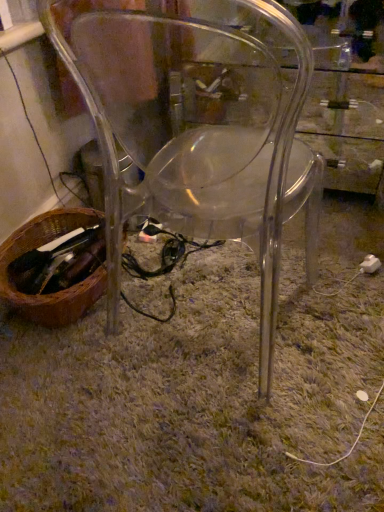
Measure the distance between green shaggy carpet at center and camera.

green shaggy carpet at center is 31.83 inches away from camera.

The image size is (384, 512). Find the location of `green shaggy carpet at center`. green shaggy carpet at center is located at coordinates (198, 401).

Does point (93, 288) come behind point (31, 468)?

Yes, it is.

From a real-world perspective, is brown woven basket at lower left above or below green shaggy carpet at center?

brown woven basket at lower left is situated higher than green shaggy carpet at center in the real world.

From the image's perspective, relative to green shaggy carpet at center, is brown woven basket at lower left above or below?

Based on their image positions, brown woven basket at lower left is located beneath green shaggy carpet at center.

Would you say brown woven basket at lower left is inside or outside green shaggy carpet at center?

brown woven basket at lower left is located beyond the bounds of green shaggy carpet at center.

Does white plastic plug at lower right have a lesser width compared to transparent plastic chair at center?

Yes.

Is white plastic plug at lower right spatially inside transparent plastic chair at center, or outside of it?

white plastic plug at lower right exists outside the volume of transparent plastic chair at center.

From a real-world perspective, is white plastic plug at lower right positioned under transparent plastic chair at center based on gravity?

Yes, from a real-world perspective, white plastic plug at lower right is below transparent plastic chair at center.

In the scene shown: Looking at the image, does white plastic plug at lower right seem bigger or smaller compared to transparent plastic chair at center?

Considering their sizes, white plastic plug at lower right takes up less space than transparent plastic chair at center.

Considering the sizes of objects transparent plastic chair at center and white plastic plug at lower right in the image provided, who is wider, transparent plastic chair at center or white plastic plug at lower right?

With larger width is transparent plastic chair at center.

Is point (201, 150) closer or farther from the camera than point (378, 265)?

Clearly, point (201, 150) is closer to the camera than point (378, 265).

Would you say transparent plastic chair at center is inside or outside white plastic plug at lower right?

transparent plastic chair at center lies outside white plastic plug at lower right.

Based on the photo, considering the relative positions of transparent plastic chair at center and white plastic plug at lower right in the image provided, is transparent plastic chair at center in front of white plastic plug at lower right?

Yes, it is in front of white plastic plug at lower right.

Is green shaggy carpet at center not within transparent plastic chair at center?

Indeed, green shaggy carpet at center is completely outside transparent plastic chair at center.

Is point (90, 494) behind point (247, 210)?

No, it is not.

In the image, is green shaggy carpet at center on the left side or the right side of transparent plastic chair at center?

green shaggy carpet at center is to the right of transparent plastic chair at center.

Does white plastic plug at lower right have a lesser width compared to brown woven basket at lower left?

Yes, white plastic plug at lower right is thinner than brown woven basket at lower left.

Is white plastic plug at lower right at the left side of brown woven basket at lower left?

In fact, white plastic plug at lower right is to the right of brown woven basket at lower left.

Could you tell me if white plastic plug at lower right is turned towards brown woven basket at lower left?

No, white plastic plug at lower right does not turn towards brown woven basket at lower left.

How much distance is there between white plastic plug at lower right and brown woven basket at lower left?

white plastic plug at lower right is 35.45 inches from brown woven basket at lower left.

Between green shaggy carpet at center and brown woven basket at lower left, which one has less height?

green shaggy carpet at center.

From a real-world perspective, is green shaggy carpet at center beneath brown woven basket at lower left?

Yes, from a real-world perspective, green shaggy carpet at center is under brown woven basket at lower left.

From the picture: Which object is wider, green shaggy carpet at center or brown woven basket at lower left?

green shaggy carpet at center.

Consider the image. Does green shaggy carpet at center have a larger size compared to brown woven basket at lower left?

Yes.

Based on the photo, what's the angular difference between white plastic plug at lower right and green shaggy carpet at center's facing directions?

58.4 degrees.

Locate an element on the screen. Image resolution: width=384 pixels, height=512 pixels. grass that is above the white plastic plug at lower right (from the image's perspective) is located at coordinates (198, 401).

Is white plastic plug at lower right inside the boundaries of green shaggy carpet at center, or outside?

white plastic plug at lower right is enclosed within green shaggy carpet at center.

Considering the positions of objects white plastic plug at lower right and green shaggy carpet at center in the image provided, who is more to the right, white plastic plug at lower right or green shaggy carpet at center?

white plastic plug at lower right is more to the right.

This screenshot has height=512, width=384. Identify the location of grass on the right side of brown woven basket at lower left. (198, 401).

Find the location of a particular element. chair that is above the white plastic plug at lower right (from a real-world perspective) is located at coordinates (200, 130).

Based on the photo, looking at the image, which one is located further to transparent plastic chair at center, brown woven basket at lower left or green shaggy carpet at center?

brown woven basket at lower left.

Estimate the real-world distances between objects in this image. Which object is closer to green shaggy carpet at center, brown woven basket at lower left or white plastic plug at lower right?

brown woven basket at lower left lies closer to green shaggy carpet at center than the other object.

Considering their positions, is green shaggy carpet at center positioned closer to transparent plastic chair at center than white plastic plug at lower right?

green shaggy carpet at center.

Looking at the image, which one is located further to white plastic plug at lower right, brown woven basket at lower left or transparent plastic chair at center?

brown woven basket at lower left is positioned further to the anchor white plastic plug at lower right.

From the image, which object appears to be farther from green shaggy carpet at center, white plastic plug at lower right or brown woven basket at lower left?

The object further to green shaggy carpet at center is white plastic plug at lower right.

Estimate the real-world distances between objects in this image. Which object is closer to white plastic plug at lower right, transparent plastic chair at center or green shaggy carpet at center?

Based on the image, green shaggy carpet at center appears to be nearer to white plastic plug at lower right.

When comparing their distances from transparent plastic chair at center, does white plastic plug at lower right or green shaggy carpet at center seem closer?

green shaggy carpet at center.

Estimate the real-world distances between objects in this image. Which object is further from brown woven basket at lower left, transparent plastic chair at center or white plastic plug at lower right?

white plastic plug at lower right is further to brown woven basket at lower left.

This screenshot has width=384, height=512. Identify the location of chair situated between brown woven basket at lower left and white plastic plug at lower right from left to right. (200, 130).

Identify the location of grass positioned between transparent plastic chair at center and brown woven basket at lower left from near to far. This screenshot has width=384, height=512. [x=198, y=401].

Find the location of `grass positioned between transparent plastic chair at center and white plastic plug at lower right from near to far`. grass positioned between transparent plastic chair at center and white plastic plug at lower right from near to far is located at coordinates (198, 401).

Locate an element on the screen. This screenshot has width=384, height=512. grass located between brown woven basket at lower left and white plastic plug at lower right in the left-right direction is located at coordinates (198, 401).